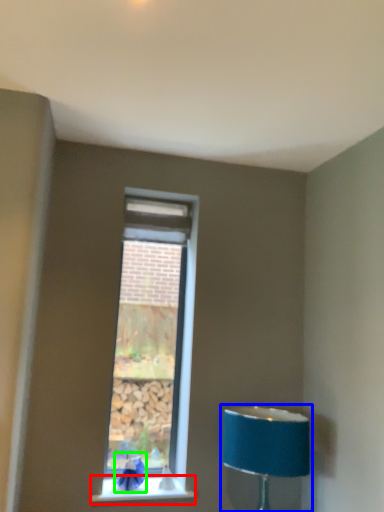
Question: Which object is the closest to the window sill (highlighted by a red box)? Choose among these: lamp (highlighted by a blue box) or swivel chair (highlighted by a green box).

Choices:
 (A) lamp
 (B) swivel chair

Answer: (B)